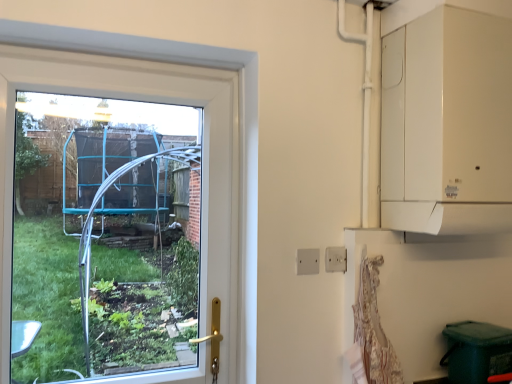
Question: From a real-world perspective, relative to transparent glass window at left, is white plastic electric outlet at center vertically above or below?

Choices:
 (A) below
 (B) above

Answer: (A)

Question: Considering the positions of white plastic electric outlet at center and transparent glass window at left in the image, is white plastic electric outlet at center wider or thinner than transparent glass window at left?

Choices:
 (A) wide
 (B) thin

Answer: (B)

Question: Considering the positions of white plastic electric outlet at center and transparent glass window at left in the image, is white plastic electric outlet at center taller or shorter than transparent glass window at left?

Choices:
 (A) tall
 (B) short

Answer: (B)

Question: Is transparent glass window at left bigger or smaller than white plastic electric outlet at center?

Choices:
 (A) big
 (B) small

Answer: (A)

Question: From a real-world perspective, is transparent glass window at left physically located above or below white plastic electric outlet at center?

Choices:
 (A) above
 (B) below

Answer: (A)

Question: Relative to white plastic electric outlet at center, is transparent glass window at left in front or behind?

Choices:
 (A) behind
 (B) front

Answer: (B)

Question: Is transparent glass window at left wider or thinner than white plastic electric outlet at center?

Choices:
 (A) thin
 (B) wide

Answer: (B)